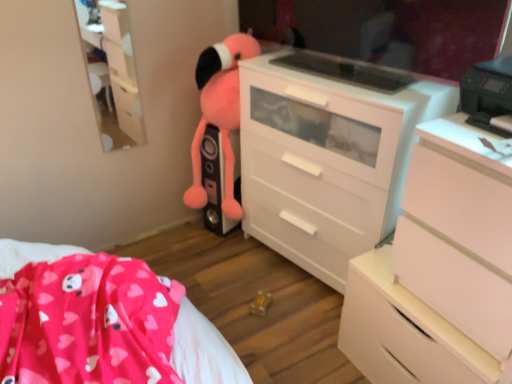
Question: Considering the relative sizes of pink plush toy at center and glossy plastic mirror at upper center in the image provided, is pink plush toy at center bigger than glossy plastic mirror at upper center?

Choices:
 (A) yes
 (B) no

Answer: (A)

Question: Is the surface of pink plush toy at center in direct contact with glossy plastic mirror at upper center?

Choices:
 (A) no
 (B) yes

Answer: (A)

Question: Is pink plush toy at center shorter than glossy plastic mirror at upper center?

Choices:
 (A) no
 (B) yes

Answer: (A)

Question: Considering the relative positions of pink plush toy at center and glossy plastic mirror at upper center in the image provided, is pink plush toy at center to the right of glossy plastic mirror at upper center from the viewer's perspective?

Choices:
 (A) no
 (B) yes

Answer: (A)

Question: Does pink plush toy at center have a greater width compared to glossy plastic mirror at upper center?

Choices:
 (A) yes
 (B) no

Answer: (A)

Question: Can you confirm if pink plush toy at center is thinner than glossy plastic mirror at upper center?

Choices:
 (A) no
 (B) yes

Answer: (A)

Question: Does white matte chest of drawers at right, the first chest of drawers viewed from the front, appear on the right side of glossy plastic mirror at upper center?

Choices:
 (A) yes
 (B) no

Answer: (A)

Question: Is white matte chest of drawers at right, which ranks as the second chest of drawers in back-to-front order, positioned far away from glossy plastic mirror at upper center?

Choices:
 (A) no
 (B) yes

Answer: (A)

Question: Is white matte chest of drawers at right, the first chest of drawers viewed from the front, aimed at glossy plastic mirror at upper center?

Choices:
 (A) no
 (B) yes

Answer: (A)

Question: From the image's perspective, is white matte chest of drawers at right, the first chest of drawers viewed from the front, above glossy plastic mirror at upper center?

Choices:
 (A) yes
 (B) no

Answer: (B)

Question: Is white matte chest of drawers at right, which ranks as the second chest of drawers in back-to-front order, directly adjacent to glossy plastic mirror at upper center?

Choices:
 (A) no
 (B) yes

Answer: (A)

Question: Can you confirm if white matte chest of drawers at right, the first chest of drawers viewed from the front, is bigger than glossy plastic mirror at upper center?

Choices:
 (A) no
 (B) yes

Answer: (B)

Question: Can you confirm if pink plush toy at center is positioned to the right of white matte chest of drawers at right, the first chest of drawers viewed from the front?

Choices:
 (A) yes
 (B) no

Answer: (B)